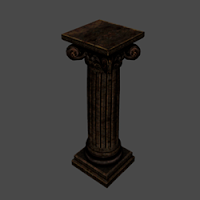
Locate an element on the screen. decorative line engraving is located at coordinates (106, 107), (101, 142), (92, 77).